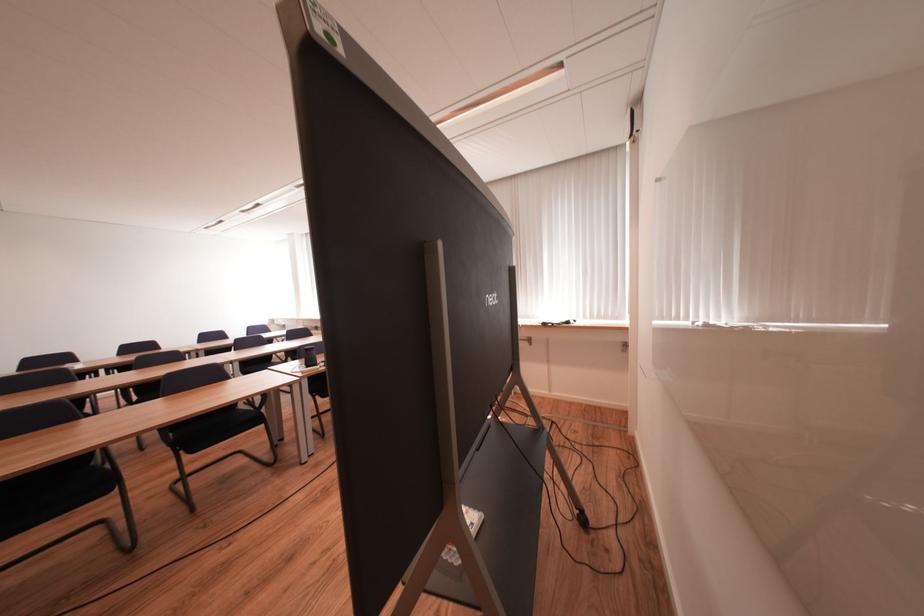
Find where to lift the small black speaker. Please return your answer as a coordinate pair (x, y).

(310, 355)